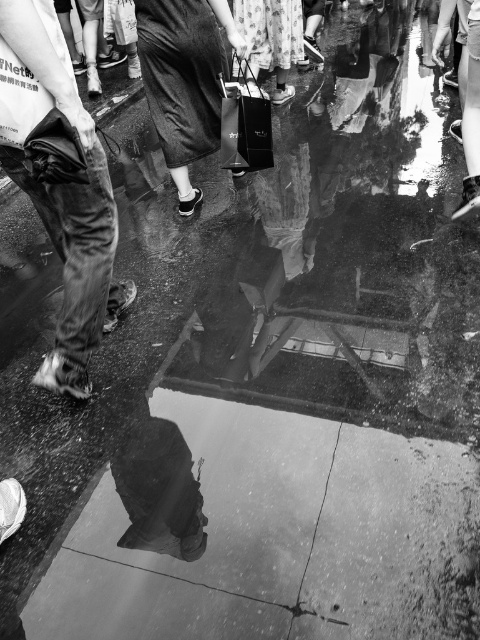
Question: Does smooth concrete sidewalk at lower center appear under matte black shopping bag at center?

Choices:
 (A) no
 (B) yes

Answer: (B)

Question: Is jeans at left smaller than matte black shopping bag at center?

Choices:
 (A) yes
 (B) no

Answer: (B)

Question: Which point appears closest to the camera in this image?

Choices:
 (A) (203, 413)
 (B) (24, 42)

Answer: (B)

Question: Among these points, which one is nearest to the camera?

Choices:
 (A) (52, 632)
 (B) (3, 92)
 (C) (253, 124)

Answer: (A)

Question: From the image, what is the correct spatial relationship of smooth concrete sidewalk at lower center in relation to jeans at left?

Choices:
 (A) below
 (B) above

Answer: (A)

Question: Which point appears closest to the camera in this image?

Choices:
 (A) (251, 164)
 (B) (347, 428)
 (C) (20, 172)

Answer: (C)